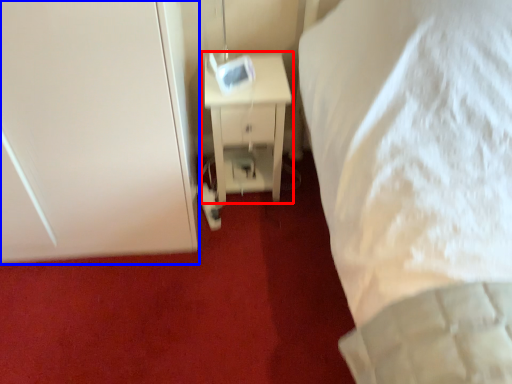
Question: Among these objects, which one is nearest to the camera, nightstand (highlighted by a red box) or door (highlighted by a blue box)?

Choices:
 (A) nightstand
 (B) door

Answer: (B)